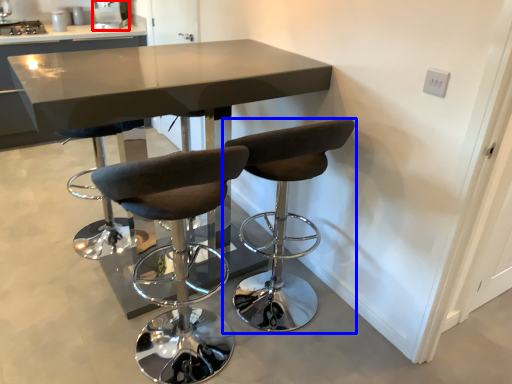
Question: Which object is closer to the camera taking this photo, appliance (highlighted by a red box) or chair (highlighted by a blue box)?

Choices:
 (A) appliance
 (B) chair

Answer: (B)